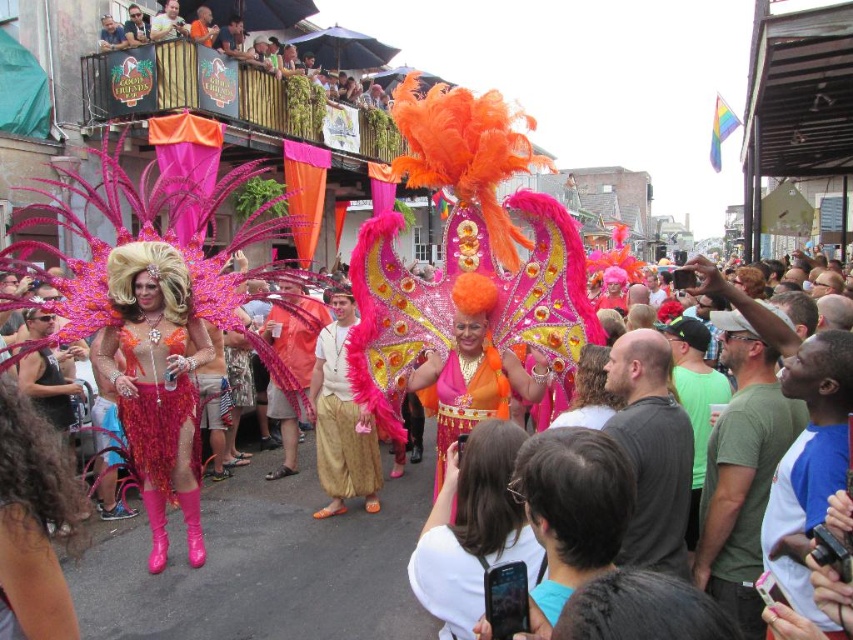
You are a photographer at the parade and want to capture both the shiny sequined dress at center and the shiny orange fabric at center in a single frame. Which one should you focus on first to ensure both are in the shot?

The shiny sequined dress at center is taller than the shiny orange fabric at center, so focusing on the shiny sequined dress at center first will help ensure both are visible in the frame.

You are a photographer at the parade and want to capture both the orange sequined dress at center and the shiny sequined skirt at center in a single frame. Which one should you focus on to ensure both are visible without cropping?

The orange sequined dress at center is bigger than the shiny sequined skirt at center, so focusing on the orange sequined dress at center would allow both to fit in the frame since it takes up more space.